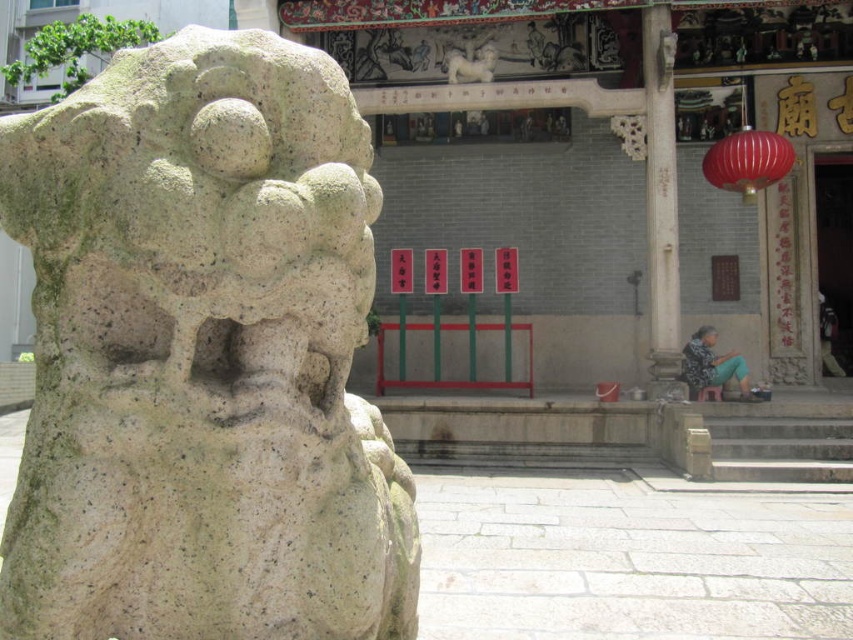
You are a visitor standing at the entrance of the temple, and you want to hang a decorative chain between the shiny red paper lantern at upper right and the white stone lion at upper center. The chain you have is 2.5 meters long. Will the chain be long enough to connect them?

The distance between the shiny red paper lantern at upper right and the white stone lion at upper center is 2.64 meters. The chain is 2.5 meters long, which is shorter than the required distance. Therefore, the chain will not be long enough to connect them.